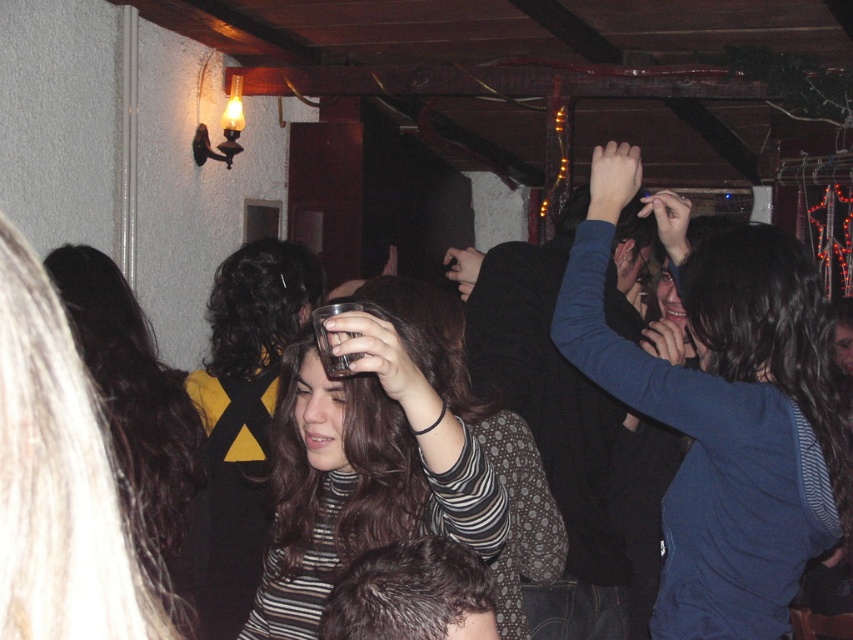
Question: Is matte plastic cup at center to the right of dark brown hair at center from the viewer's perspective?

Choices:
 (A) yes
 (B) no

Answer: (A)

Question: Among these points, which one is farthest from the camera?

Choices:
 (A) (155, 516)
 (B) (302, 384)

Answer: (A)

Question: Where is matte plastic cup at center located in relation to dark brown hair at center in the image?

Choices:
 (A) left
 (B) right

Answer: (B)

Question: Is matte plastic cup at center positioned behind dark brown hair at center?

Choices:
 (A) no
 (B) yes

Answer: (A)

Question: Estimate the real-world distances between objects in this image. Which object is farther from the matte plastic cup at center?

Choices:
 (A) dark brown hair at center
 (B) striped fabric shirt at center

Answer: (A)

Question: Which object is farther from the camera taking this photo?

Choices:
 (A) matte plastic cup at center
 (B) dark brown hair at center
 (C) striped fabric shirt at center

Answer: (B)